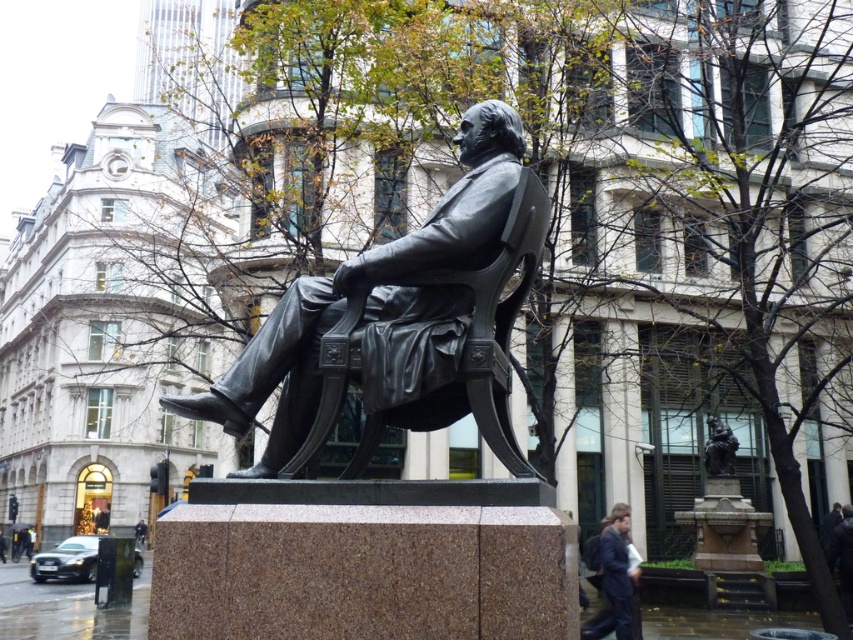
Question: Does polished bronze statue at center appear over bronze statue at center?

Choices:
 (A) no
 (B) yes

Answer: (B)

Question: Which object is the closest to the bronze statue at center?

Choices:
 (A) polished bronze statue at center
 (B) dark blue suit at lower right

Answer: (B)

Question: Can you confirm if dark blue suit at lower right is wider than bronze statue at center?

Choices:
 (A) no
 (B) yes

Answer: (B)

Question: Estimate the real-world distances between objects in this image. Which object is farther from the dark blue suit at lower right?

Choices:
 (A) polished bronze statue at center
 (B) bronze statue at center

Answer: (A)

Question: Based on their relative distances, which object is nearer to the dark blue suit at lower right?

Choices:
 (A) polished bronze statue at center
 (B) bronze statue at center

Answer: (B)

Question: Considering the relative positions of polished bronze statue at center and dark blue suit at lower right in the image provided, where is polished bronze statue at center located with respect to dark blue suit at lower right?

Choices:
 (A) left
 (B) right

Answer: (A)